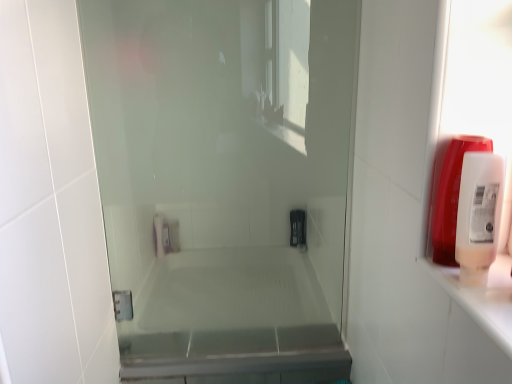
Measure the distance between point (448, 205) and camera.

The depth of point (448, 205) is 29.02 inches.

Describe the element at coordinates (448, 195) in the screenshot. I see `translucent plastic soap dispenser at right, the 1th soap dispenser in the back-to-front sequence` at that location.

Where is `translucent plastic soap dispenser at right, the 1th soap dispenser in the back-to-front sequence`? This screenshot has width=512, height=384. translucent plastic soap dispenser at right, the 1th soap dispenser in the back-to-front sequence is located at coordinates (448, 195).

Based on the photo, from the image's perspective, is white plastic soap dispenser at right, placed as the 1th soap dispenser when sorted from front to back, below translucent plastic soap dispenser at right, the 1th soap dispenser in the back-to-front sequence?

Yes, from the image's perspective, white plastic soap dispenser at right, placed as the 1th soap dispenser when sorted from front to back, is beneath translucent plastic soap dispenser at right, the 1th soap dispenser in the back-to-front sequence.

Is white plastic soap dispenser at right, placed as the 1th soap dispenser when sorted from front to back, positioned behind translucent plastic soap dispenser at right, which is the 2th soap dispenser in front-to-back order?

No, white plastic soap dispenser at right, placed as the 1th soap dispenser when sorted from front to back, is closer to the viewer.

At what (x,y) coordinates should I click in order to perform the action: click on soap dispenser to the right of white plastic soap dispenser at right, placed as the 1th soap dispenser when sorted from front to back. Please return your answer as a coordinate pair (x, y). Looking at the image, I should click on (448, 195).

Which is correct: white plastic soap dispenser at right, the 2th soap dispenser when ordered from back to front, is inside translucent plastic soap dispenser at right, the 1th soap dispenser in the back-to-front sequence, or outside of it?

white plastic soap dispenser at right, the 2th soap dispenser when ordered from back to front, is not inside translucent plastic soap dispenser at right, the 1th soap dispenser in the back-to-front sequence, it's outside.

Between transparent glass shower door at center and translucent plastic soap dispenser at right, the 1th soap dispenser in the back-to-front sequence, which one is positioned behind?

transparent glass shower door at center is further from the camera.

Is translucent plastic soap dispenser at right, the 1th soap dispenser in the back-to-front sequence, located within transparent glass shower door at center?

No, translucent plastic soap dispenser at right, the 1th soap dispenser in the back-to-front sequence, is not surrounded by transparent glass shower door at center.

Can you confirm if transparent glass shower door at center is positioned to the right of translucent plastic soap dispenser at right, the 1th soap dispenser in the back-to-front sequence?

In fact, transparent glass shower door at center is to the left of translucent plastic soap dispenser at right, the 1th soap dispenser in the back-to-front sequence.

Looking at this image, from the image's perspective, is transparent glass shower door at center located above translucent plastic soap dispenser at right, the 1th soap dispenser in the back-to-front sequence?

No, from the image's perspective, transparent glass shower door at center is not on top of translucent plastic soap dispenser at right, the 1th soap dispenser in the back-to-front sequence.

Is transparent glass shower door at center to the right of white plastic soap dispenser at right, the 2th soap dispenser when ordered from back to front, from the viewer's perspective?

In fact, transparent glass shower door at center is to the left of white plastic soap dispenser at right, the 2th soap dispenser when ordered from back to front.

From the image's perspective, is transparent glass shower door at center located above white plastic soap dispenser at right, placed as the 1th soap dispenser when sorted from front to back?

Yes, from the image's perspective, transparent glass shower door at center is above white plastic soap dispenser at right, placed as the 1th soap dispenser when sorted from front to back.

Is transparent glass shower door at center inside or outside of white plastic soap dispenser at right, placed as the 1th soap dispenser when sorted from front to back?

transparent glass shower door at center is outside white plastic soap dispenser at right, placed as the 1th soap dispenser when sorted from front to back.

In the scene shown: In terms of width, does translucent plastic soap dispenser at right, which is the 2th soap dispenser in front-to-back order, look wider or thinner when compared to transparent glass shower door at center?

translucent plastic soap dispenser at right, which is the 2th soap dispenser in front-to-back order, is wider than transparent glass shower door at center.

Which point is more distant from viewer, (x=460, y=138) or (x=338, y=334)?

Positioned behind is point (x=338, y=334).

From the image's perspective, which is above, translucent plastic soap dispenser at right, the 1th soap dispenser in the back-to-front sequence, or transparent glass shower door at center?

translucent plastic soap dispenser at right, the 1th soap dispenser in the back-to-front sequence.

In the scene shown: How distant is translucent plastic soap dispenser at right, the 1th soap dispenser in the back-to-front sequence, from white plastic soap dispenser at right, placed as the 1th soap dispenser when sorted from front to back?

1.95 inches.

Which is in front, point (444, 171) or point (476, 173)?

The point (476, 173) is in front.

Can you confirm if translucent plastic soap dispenser at right, which is the 2th soap dispenser in front-to-back order, is wider than white plastic soap dispenser at right, the 2th soap dispenser when ordered from back to front?

No.

Is translucent plastic soap dispenser at right, the 1th soap dispenser in the back-to-front sequence, positioned far away from white plastic soap dispenser at right, the 2th soap dispenser when ordered from back to front?

No.

Can you confirm if white plastic soap dispenser at right, the 2th soap dispenser when ordered from back to front, is shorter than transparent glass shower door at center?

Correct, white plastic soap dispenser at right, the 2th soap dispenser when ordered from back to front, is not as tall as transparent glass shower door at center.

Considering the positions of objects white plastic soap dispenser at right, the 2th soap dispenser when ordered from back to front, and transparent glass shower door at center in the image provided, who is more to the right, white plastic soap dispenser at right, the 2th soap dispenser when ordered from back to front, or transparent glass shower door at center?

From the viewer's perspective, white plastic soap dispenser at right, the 2th soap dispenser when ordered from back to front, appears more on the right side.

Is white plastic soap dispenser at right, the 2th soap dispenser when ordered from back to front, not close to transparent glass shower door at center?

white plastic soap dispenser at right, the 2th soap dispenser when ordered from back to front, is actually quite close to transparent glass shower door at center.

From the image's perspective, between white plastic soap dispenser at right, the 2th soap dispenser when ordered from back to front, and transparent glass shower door at center, who is located below?

white plastic soap dispenser at right, the 2th soap dispenser when ordered from back to front, is shown below in the image.

Find the location of `soap dispenser on the left of translucent plastic soap dispenser at right, which is the 2th soap dispenser in front-to-back order`. soap dispenser on the left of translucent plastic soap dispenser at right, which is the 2th soap dispenser in front-to-back order is located at coordinates (478, 215).

The width and height of the screenshot is (512, 384). In order to click on the 1st soap dispenser in front of the transparent glass shower door at center, starting your count from the anchor in this screenshot , I will do `click(448, 195)`.

In the scene shown: From the image, which object appears to be farther from transparent glass shower door at center, white plastic soap dispenser at right, placed as the 1th soap dispenser when sorted from front to back, or translucent plastic soap dispenser at right, which is the 2th soap dispenser in front-to-back order?

The object further to transparent glass shower door at center is white plastic soap dispenser at right, placed as the 1th soap dispenser when sorted from front to back.

Estimate the real-world distances between objects in this image. Which object is closer to translucent plastic soap dispenser at right, which is the 2th soap dispenser in front-to-back order, white plastic soap dispenser at right, placed as the 1th soap dispenser when sorted from front to back, or transparent glass shower door at center?

Based on the image, white plastic soap dispenser at right, placed as the 1th soap dispenser when sorted from front to back, appears to be nearer to translucent plastic soap dispenser at right, which is the 2th soap dispenser in front-to-back order.

When comparing their distances from white plastic soap dispenser at right, the 2th soap dispenser when ordered from back to front, does translucent plastic soap dispenser at right, which is the 2th soap dispenser in front-to-back order, or transparent glass shower door at center seem closer?

translucent plastic soap dispenser at right, which is the 2th soap dispenser in front-to-back order, is positioned closer to the anchor white plastic soap dispenser at right, the 2th soap dispenser when ordered from back to front.

From the image, which object appears to be nearer to transparent glass shower door at center, translucent plastic soap dispenser at right, which is the 2th soap dispenser in front-to-back order, or white plastic soap dispenser at right, the 2th soap dispenser when ordered from back to front?

translucent plastic soap dispenser at right, which is the 2th soap dispenser in front-to-back order, lies closer to transparent glass shower door at center than the other object.

Looking at the image, which one is located further to translucent plastic soap dispenser at right, the 1th soap dispenser in the back-to-front sequence, transparent glass shower door at center or white plastic soap dispenser at right, the 2th soap dispenser when ordered from back to front?

transparent glass shower door at center is further to translucent plastic soap dispenser at right, the 1th soap dispenser in the back-to-front sequence.

Based on their spatial positions, is transparent glass shower door at center or translucent plastic soap dispenser at right, the 1th soap dispenser in the back-to-front sequence, further from white plastic soap dispenser at right, placed as the 1th soap dispenser when sorted from front to back?

transparent glass shower door at center is further to white plastic soap dispenser at right, placed as the 1th soap dispenser when sorted from front to back.

Locate an element on the screen. The width and height of the screenshot is (512, 384). soap dispenser between transparent glass shower door at center and translucent plastic soap dispenser at right, which is the 2th soap dispenser in front-to-back order, from left to right is located at coordinates (478, 215).